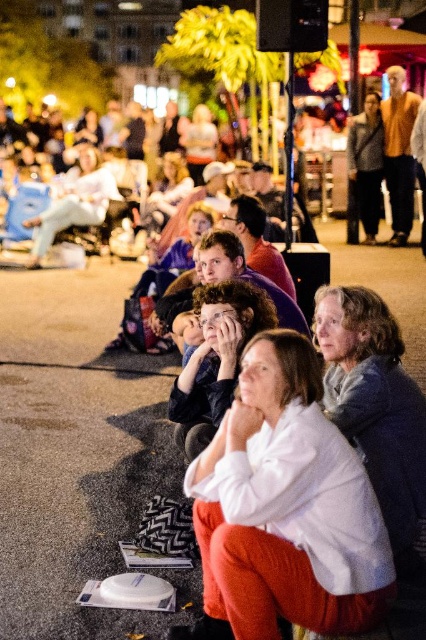
Question: Which point appears farthest from the camera in this image?

Choices:
 (A) (382, 387)
 (B) (218, 602)

Answer: (A)

Question: Does white cotton shirt at center have a greater width compared to gray wool sweater at center?

Choices:
 (A) yes
 (B) no

Answer: (A)

Question: Considering the relative positions of white cotton shirt at center and gray wool sweater at center in the image provided, where is white cotton shirt at center located with respect to gray wool sweater at center?

Choices:
 (A) above
 (B) below

Answer: (B)

Question: Which point is farther to the camera?

Choices:
 (A) (293, 516)
 (B) (382, 467)

Answer: (B)

Question: Can you confirm if white cotton shirt at center is bigger than gray wool sweater at center?

Choices:
 (A) no
 (B) yes

Answer: (B)